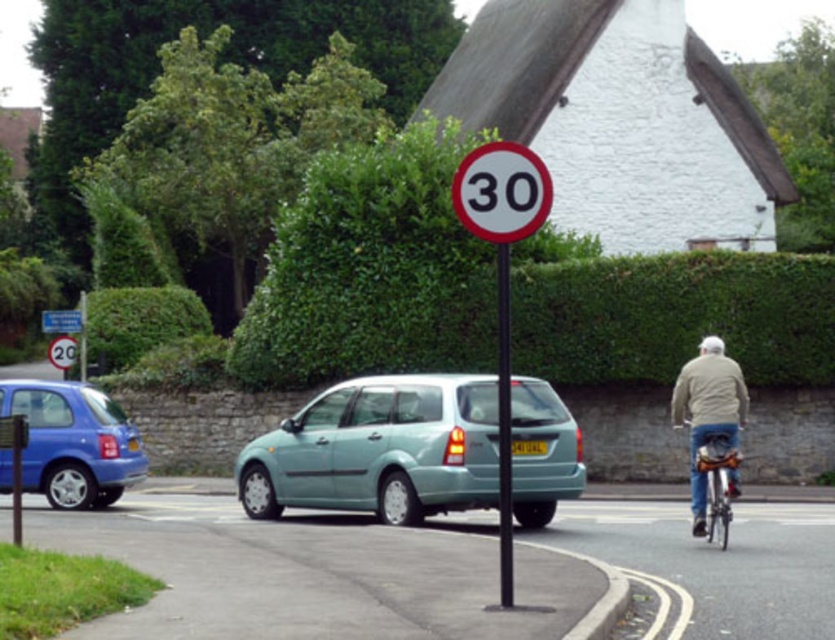
You are a delivery driver who needs to ensure your vehicle adheres to local regulations. You observe the white plastic speed limit sign at center and the yellow metallic license plate at center in your rearview mirror. Which object appears bigger in your mirror?

The white plastic speed limit sign at center appears bigger in the mirror because it has a larger size compared to the yellow metallic license plate at center.

You are a pedestrian crossing the road and see the white plastic speed limit sign at center and the yellow metallic license plate at center. Which object is positioned higher relative to the other?

The white plastic speed limit sign at center is located above the yellow metallic license plate at center, so it is positioned higher.